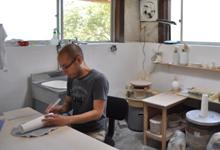
Identify the location of sink. This screenshot has width=220, height=150. [x=58, y=83].